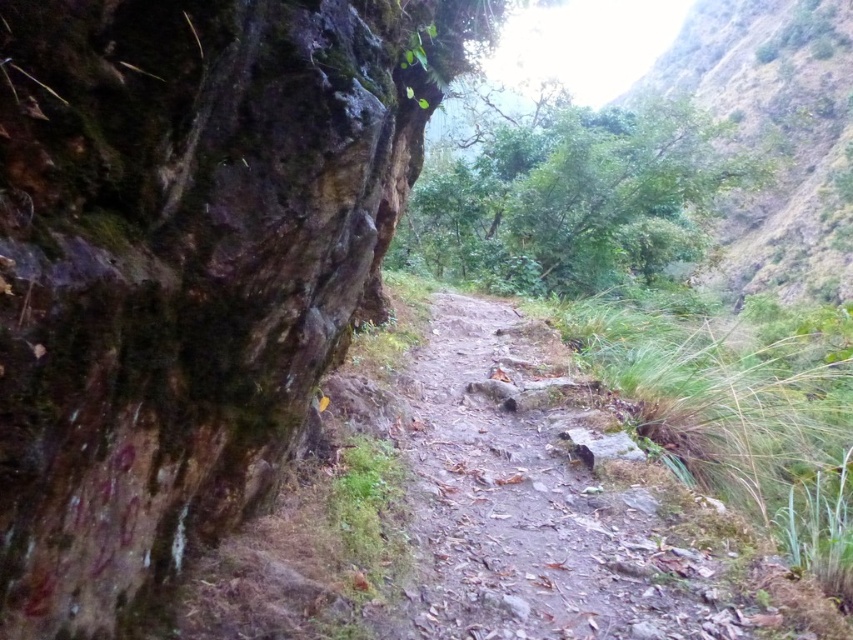
Question: Observing the image, what is the correct spatial positioning of green mossy rock at left in reference to green leafy hillside at upper right?

Choices:
 (A) below
 (B) above

Answer: (A)

Question: Is green mossy rock at left bigger than dusty gravel path at center?

Choices:
 (A) yes
 (B) no

Answer: (A)

Question: Which of the following is the closest to the observer?

Choices:
 (A) green leafy hillside at upper right
 (B) green mossy rock at left
 (C) dusty gravel path at center

Answer: (B)

Question: Which of the following is the closest to the observer?

Choices:
 (A) (527, 554)
 (B) (345, 61)
 (C) (703, 28)

Answer: (B)

Question: Can you confirm if dusty gravel path at center is positioned to the left of green leafy hillside at upper right?

Choices:
 (A) yes
 (B) no

Answer: (A)

Question: Among these points, which one is farthest from the camera?

Choices:
 (A) [152, 214]
 (B) [846, 200]
 (C) [538, 349]

Answer: (B)